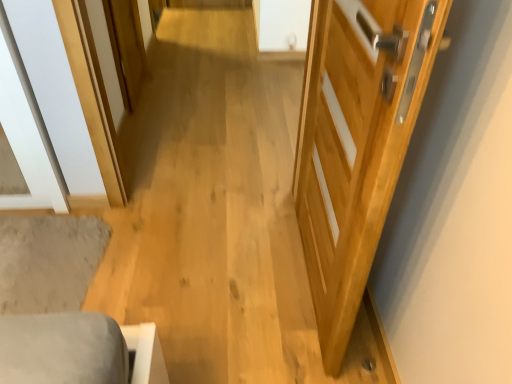
Identify the location of free space in front of natural wood door at right. The height and width of the screenshot is (384, 512). (285, 340).